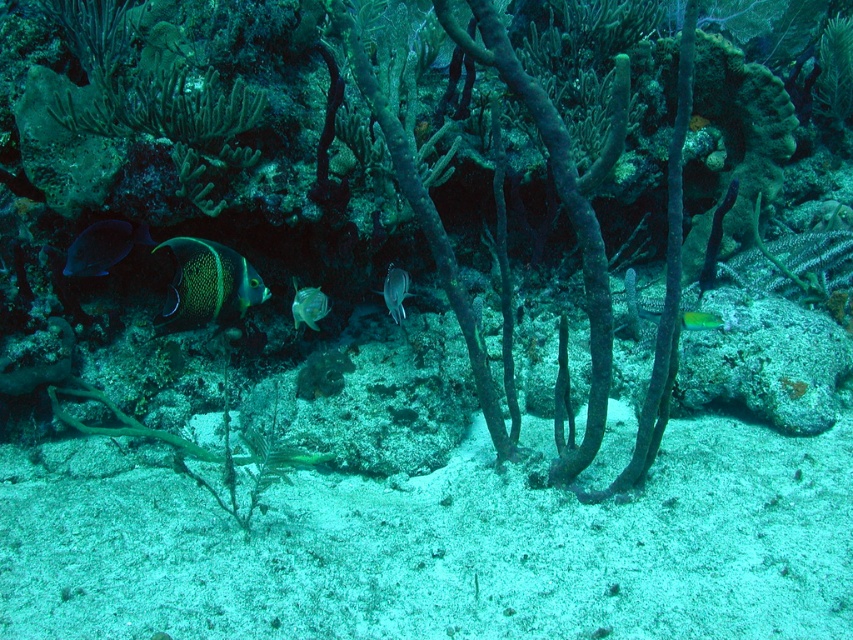
Question: Among these points, which one is nearest to the camera?

Choices:
 (A) (715, 316)
 (B) (138, 228)
 (C) (384, 282)

Answer: (B)

Question: Is matte blue fish at left to the left of translucent green fish at center from the viewer's perspective?

Choices:
 (A) yes
 (B) no

Answer: (A)

Question: Can you confirm if matte blue fish at left is bigger than translucent green fish at center?

Choices:
 (A) yes
 (B) no

Answer: (B)

Question: Which of the following is the closest to the observer?

Choices:
 (A) translucent glass fish at center
 (B) matte blue fish at left
 (C) translucent green fish at center

Answer: (B)

Question: Is matte blue fish at left in front of translucent glass fish at center?

Choices:
 (A) no
 (B) yes

Answer: (B)

Question: Which point is farther to the camera?

Choices:
 (A) green iridescent fish at center
 (B) translucent green fish at center

Answer: (B)